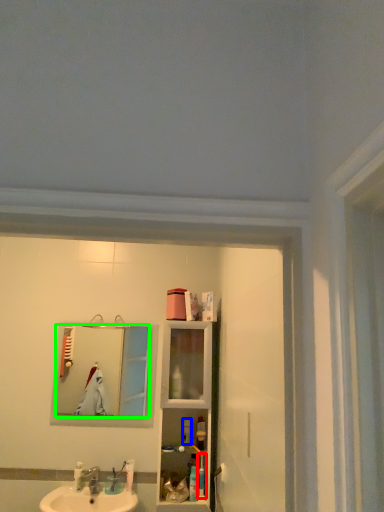
Question: Which object is the farthest from toiletry (highlighted by a red box)? Choose among these: toiletry (highlighted by a blue box) or mirror (highlighted by a green box).

Choices:
 (A) toiletry
 (B) mirror

Answer: (B)